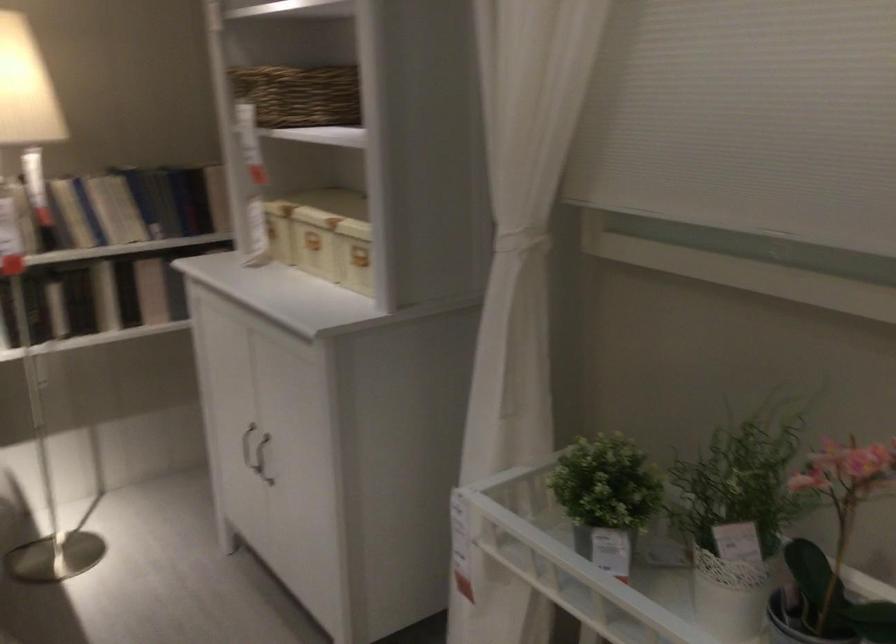
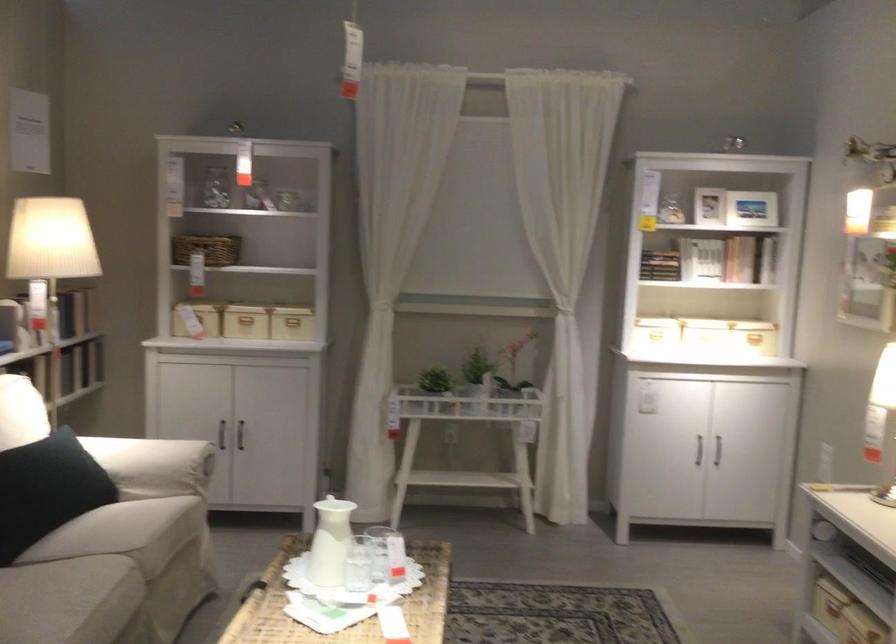
In the second image, find the point that corresponds to point (362, 258) in the first image.

(291, 321)